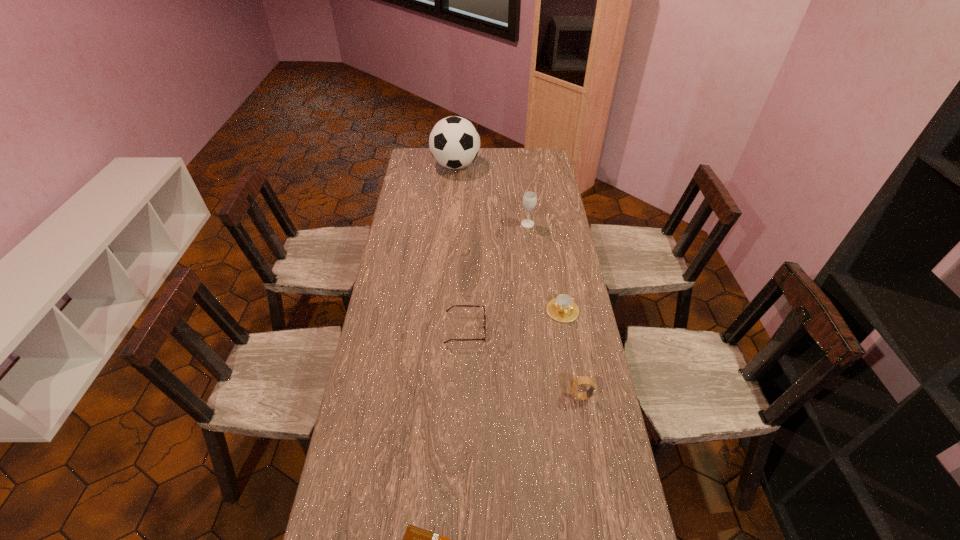
Select which object appears as the fourth closest to the wineglass. Please provide its 2D coordinates. Your answer should be formatted as a tuple, i.e. [(x, y)], where the tuple contains the x and y coordinates of a point satisfying the conditions above.

[(575, 383)]

Point out which object is positioned as the third nearest to the third shortest object. Please provide its 2D coordinates. Your answer should be formatted as a tuple, i.e. [(x, y)], where the tuple contains the x and y coordinates of a point satisfying the conditions above.

[(529, 199)]

Identify the location of vacant space that satisfies the following two spatial constraints: 1. with the handle on the side of the cup; 2. on the lenses of the spectacles. [565, 329].

Locate an element on the screen. This screenshot has width=960, height=540. free space that satisfies the following two spatial constraints: 1. with the handle on the side of the third shortest object; 2. on the lenses of the fifth tallest object is located at coordinates (565, 329).